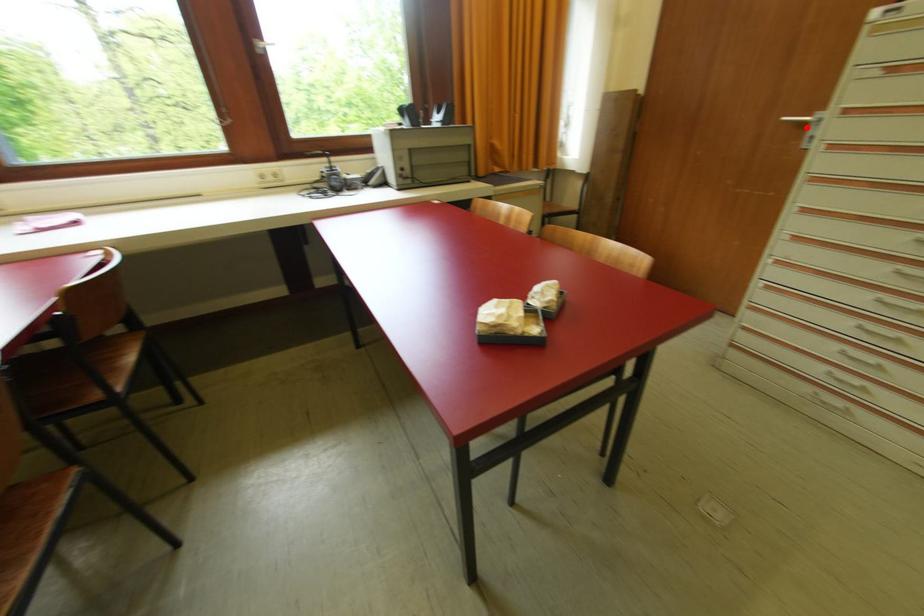
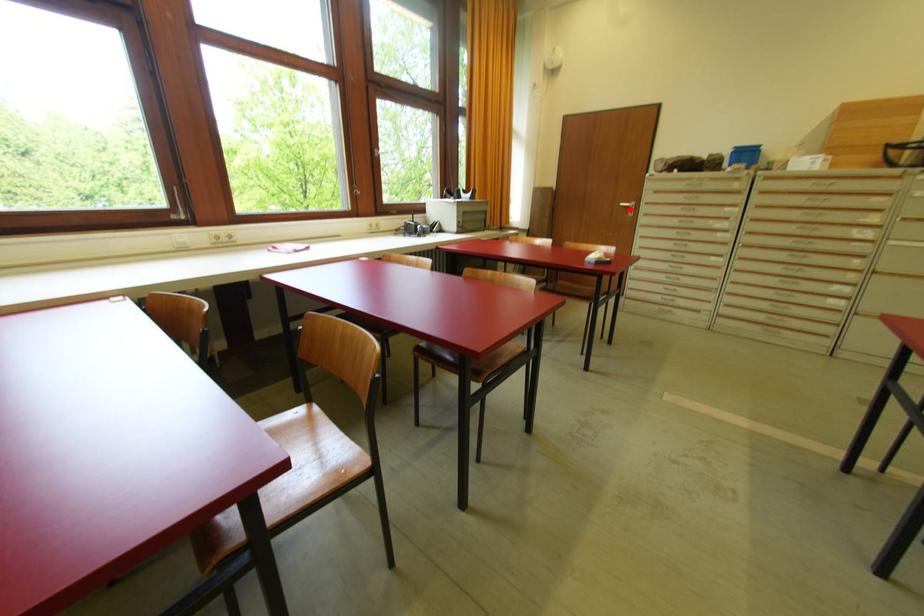
I am providing you with two images of the same scene from different viewpoints. A red point is marked on the first image and another point is marked on the second image. Do the highlighted points in image1 and image2 indicate the same real-world spot?

Yes